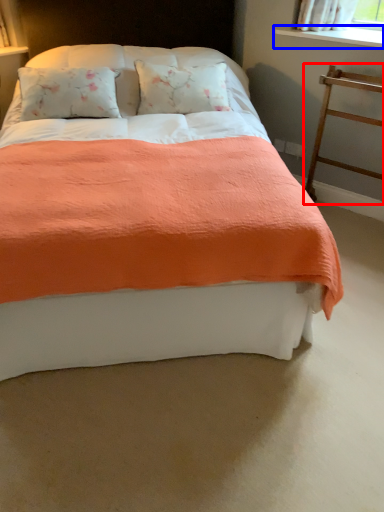
Question: Which point is closer to the camera, balustrade (highlighted by a red box) or window sill (highlighted by a blue box)?

Choices:
 (A) balustrade
 (B) window sill

Answer: (A)